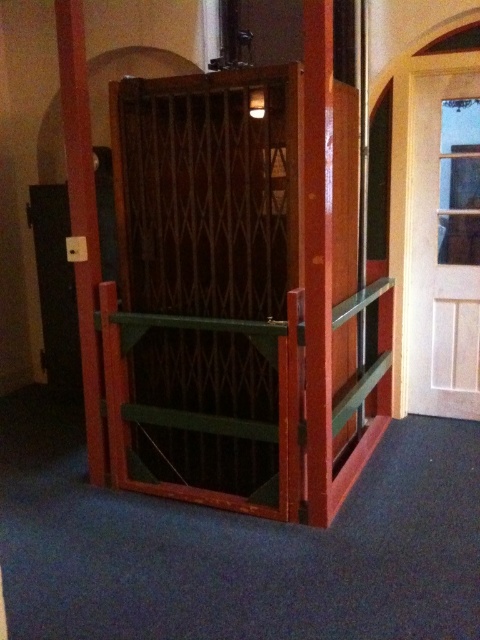
Question: Considering the real-world distances, which object is farthest from the metallic silver elevator at center?

Choices:
 (A) wooden pole at left
 (B) green wood balustrade at center

Answer: (A)

Question: Which point is farther to the camera?

Choices:
 (A) (383, 358)
 (B) (72, 193)
 (C) (470, 188)
 (D) (144, 116)

Answer: (A)

Question: Does metallic silver elevator at center come in front of wooden pole at left?

Choices:
 (A) yes
 (B) no

Answer: (A)

Question: Is white wooden door at upper right below green wood balustrade at center?

Choices:
 (A) yes
 (B) no

Answer: (B)

Question: Can you confirm if white wooden door at upper right is thinner than green wood balustrade at center?

Choices:
 (A) yes
 (B) no

Answer: (A)

Question: Which point is closer to the camera?

Choices:
 (A) (170, 449)
 (B) (113, 476)

Answer: (B)